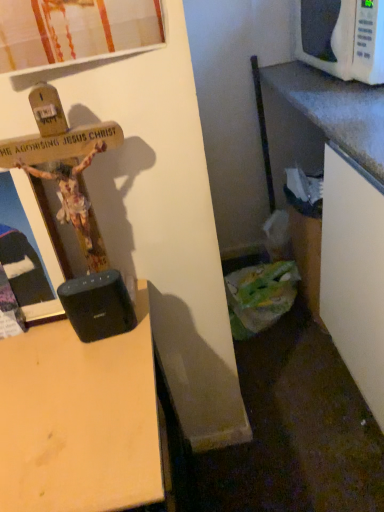
Question: In terms of height, does white plastic microwave at upper right look taller or shorter compared to wooden desk at center?

Choices:
 (A) tall
 (B) short

Answer: (B)

Question: Considering the positions of point (336, 36) and point (94, 359), is point (336, 36) closer or farther from the camera than point (94, 359)?

Choices:
 (A) farther
 (B) closer

Answer: (A)

Question: From the image's perspective, is white plastic microwave at upper right above or below wooden desk at center?

Choices:
 (A) above
 (B) below

Answer: (A)

Question: From the image's perspective, is wooden desk at center positioned above or below white plastic microwave at upper right?

Choices:
 (A) below
 (B) above

Answer: (A)

Question: In the image, is wooden desk at center on the left side or the right side of white plastic microwave at upper right?

Choices:
 (A) right
 (B) left

Answer: (B)

Question: In terms of size, does wooden desk at center appear bigger or smaller than white plastic microwave at upper right?

Choices:
 (A) small
 (B) big

Answer: (B)

Question: From a real-world perspective, relative to white plastic microwave at upper right, is wooden desk at center vertically above or below?

Choices:
 (A) below
 (B) above

Answer: (A)